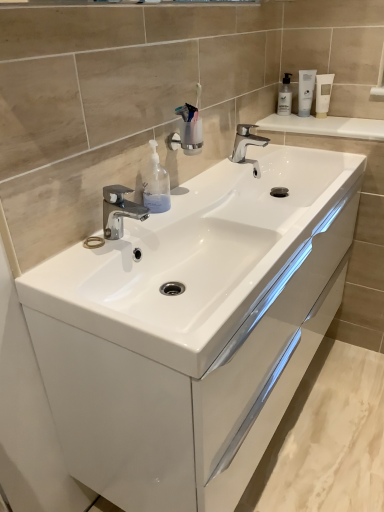
The image size is (384, 512). Identify the location of free point to the right of transparent plastic soap dispenser at center, which is counted as the 2th soap dispenser, starting from the top. (205, 203).